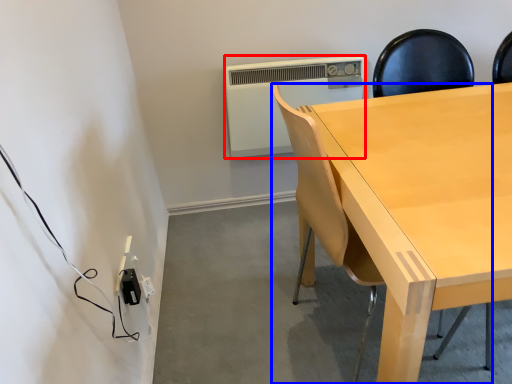
Question: Which object is closer to the camera taking this photo, air conditioning (highlighted by a red box) or chair (highlighted by a blue box)?

Choices:
 (A) air conditioning
 (B) chair

Answer: (B)